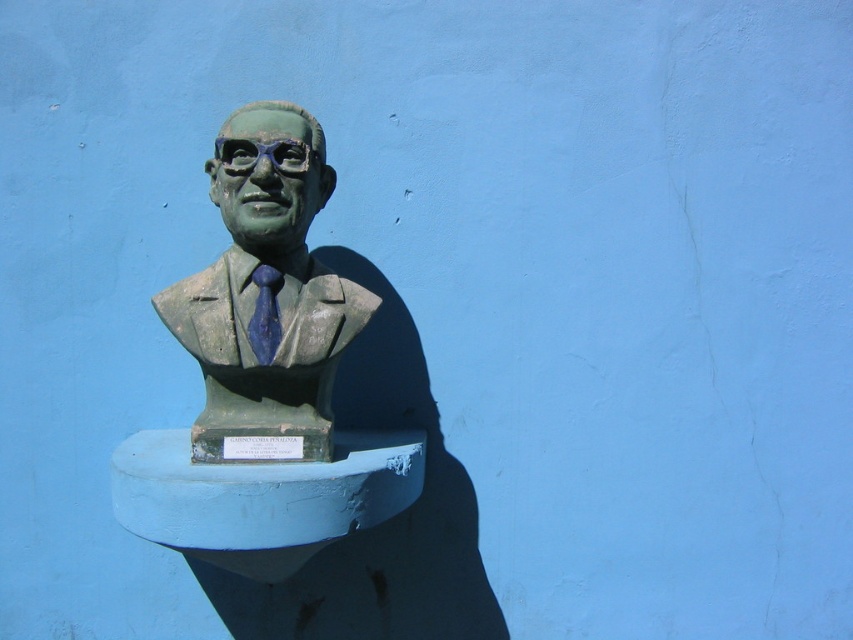
Question: Is green matte/glossy goggles at center positioned in front of blue matte tie at center?

Choices:
 (A) yes
 (B) no

Answer: (A)

Question: Which of the following is the closest to the observer?

Choices:
 (A) (305, 154)
 (B) (265, 308)
 (C) (254, 104)

Answer: (A)

Question: Is green stone bust at center to the left of blue matte tie at center from the viewer's perspective?

Choices:
 (A) no
 (B) yes

Answer: (A)

Question: Which of the following is the closest to the observer?

Choices:
 (A) (224, 141)
 (B) (257, 301)
 (C) (271, 189)

Answer: (C)

Question: Among these objects, which one is nearest to the camera?

Choices:
 (A) green stone bust at center
 (B) green matte/glossy goggles at center

Answer: (A)

Question: Can you confirm if green stone bust at center is positioned above blue matte tie at center?

Choices:
 (A) yes
 (B) no

Answer: (A)